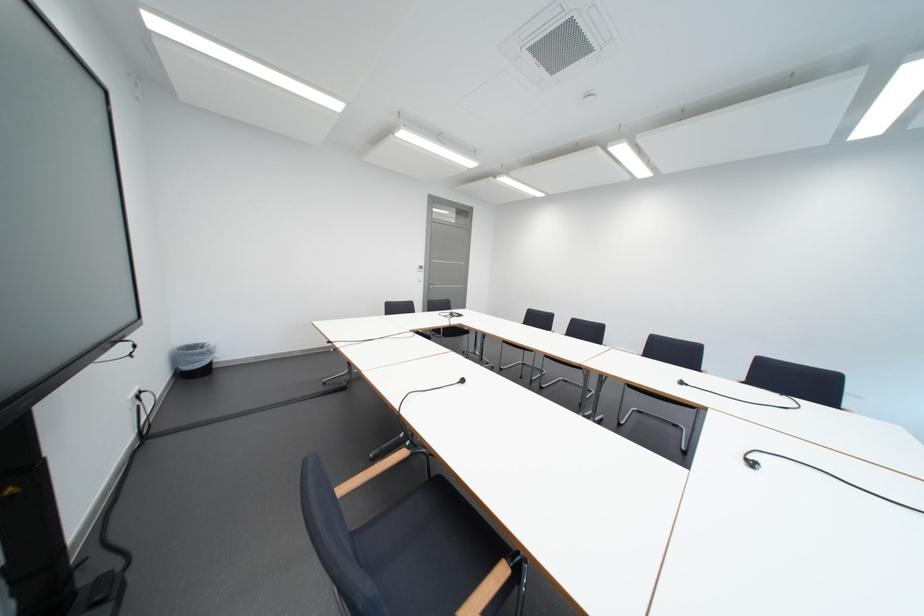
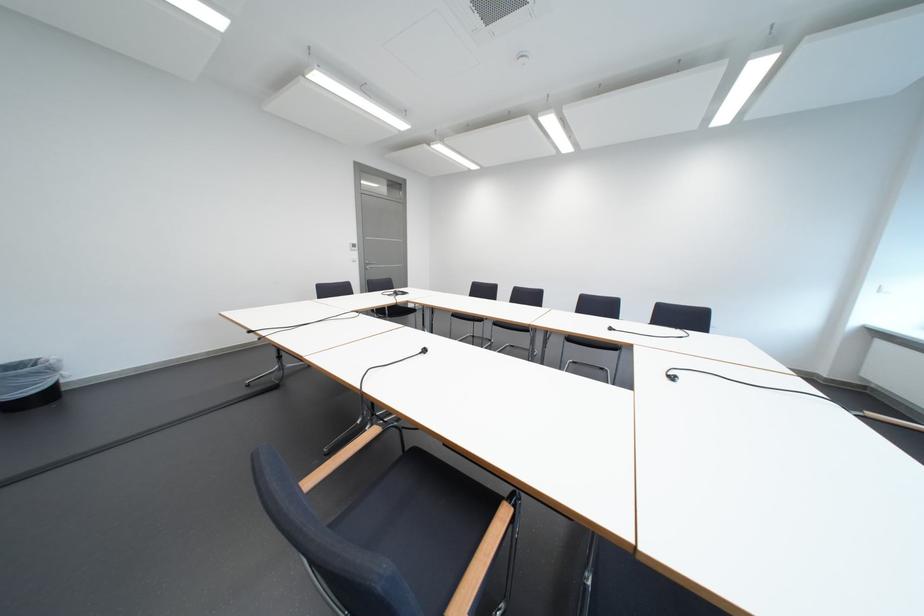
The point at (x=202, y=352) is marked in the first image. Where is the corresponding point in the second image?

(23, 373)